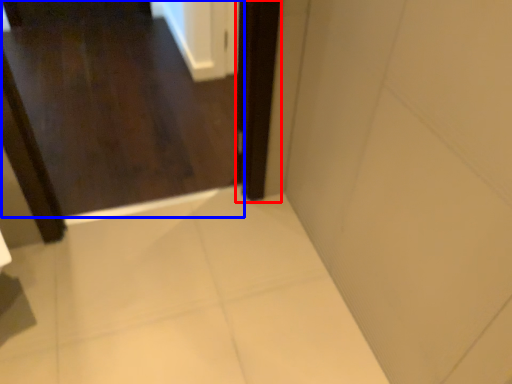
Question: Which of the following is the closest to the observer, screen door (highlighted by a red box) or door (highlighted by a blue box)?

Choices:
 (A) screen door
 (B) door

Answer: (A)